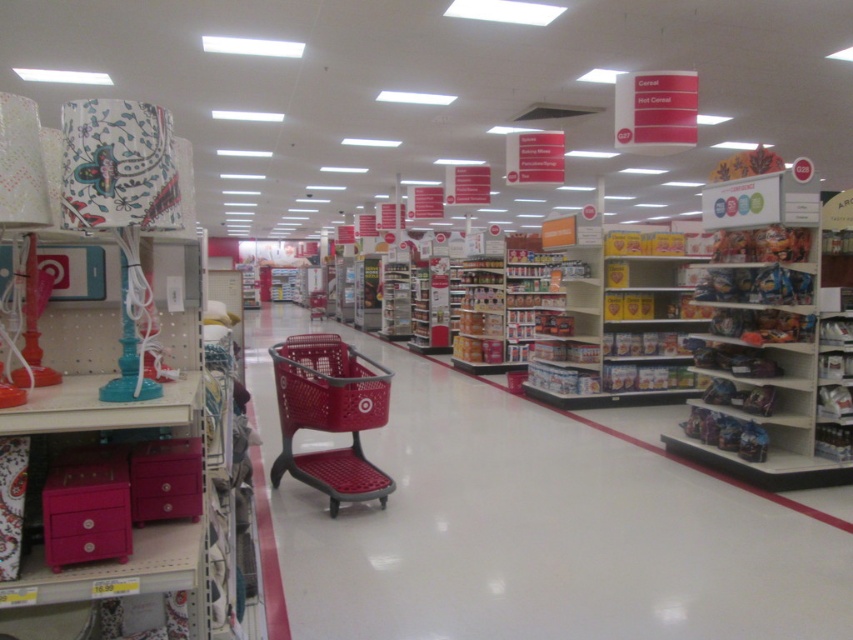
Question: Can you confirm if plastic shopping cart at center is positioned below matte plastic shopping cart at center?

Choices:
 (A) no
 (B) yes

Answer: (B)

Question: Is plastic shopping cart at center wider than matte plastic shopping cart at center?

Choices:
 (A) yes
 (B) no

Answer: (A)

Question: Which of the following is the closest to the observer?

Choices:
 (A) plastic shopping cart at center
 (B) matte plastic shopping cart at center

Answer: (A)

Question: Does plastic shopping cart at center have a smaller size compared to matte plastic shopping cart at center?

Choices:
 (A) no
 (B) yes

Answer: (A)